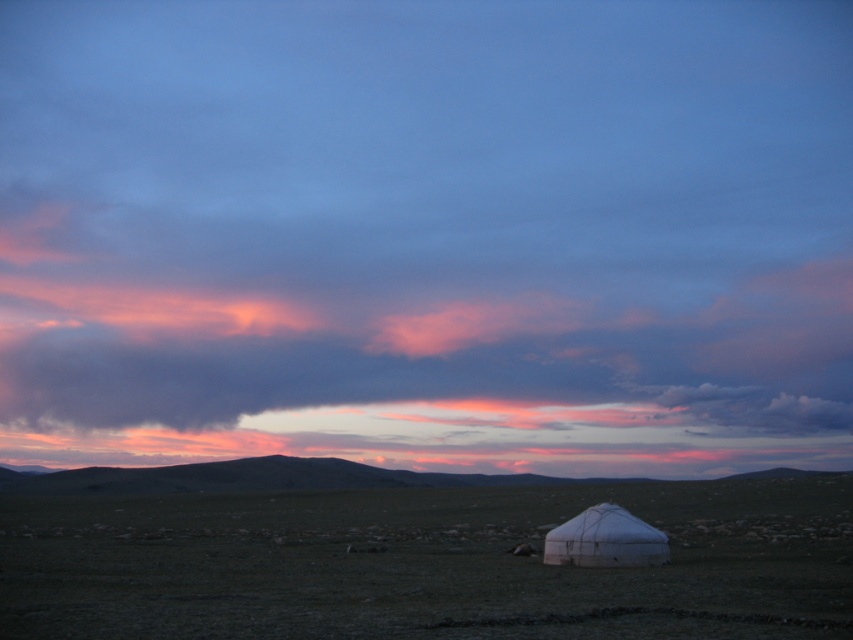
You are standing in the middle of the green grassland at lower center and want to look up at the dark gray cloud at upper center. In which direction should you turn your head?

You should turn your head to the left because the dark gray cloud at upper center is positioned on the left side of the green grassland at lower center.

You are standing in front of the white fabric tent at lower center and want to look at the smooth earthy horizon at center. In which direction should you look?

You should look downward because the smooth earthy horizon at center is located below the white fabric tent at lower center.

You are an astronaut observing the Earth from a spaceship. You notice the dark gray cloud at upper center and the green grassland at lower center. Which of these two features has a greater horizontal extent when viewed from above?

The dark gray cloud at upper center has a greater horizontal extent than the green grassland at lower center, as its width is larger according to the description.